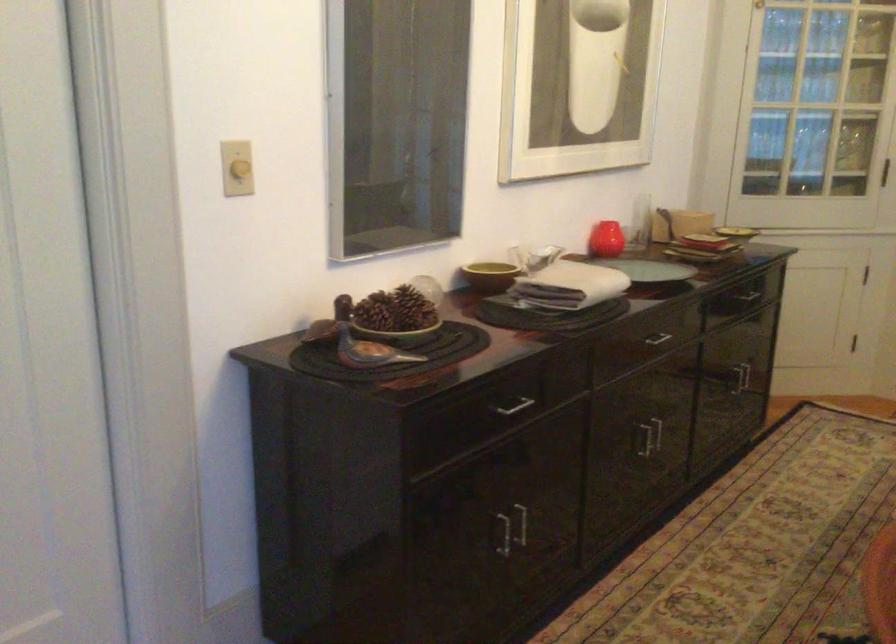
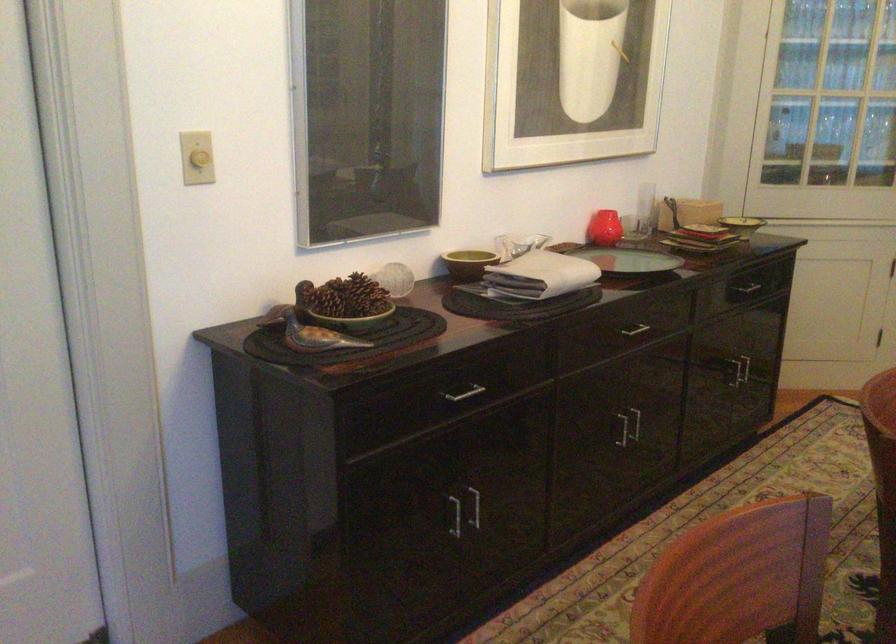
In the second image, find the point that corresponds to [607,240] in the first image.

(604, 228)